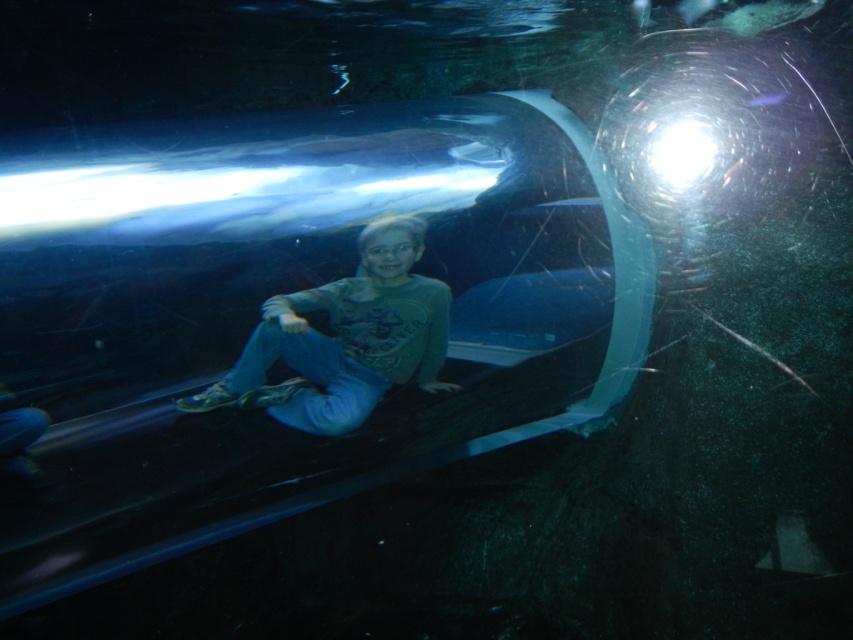
You are a diver in the aquarium tunnel. You see the matte gray shirt at center and the transparent glass bubble at upper center. Which object is closer to the light source in the upper right corner?

The transparent glass bubble at upper center is closer to the light source in the upper right corner because it is positioned above the matte gray shirt at center, which is located below it.

You are a photographer trying to capture a clear image of the point at coordinates (308, 305) in the underwater scene. Based on the provided information, what is the minimum distance your camera should be set to focus at to ensure the point is in sharp focus?

The point at coordinates (308, 305) is 4.85 feet from the camera, so the camera should be set to focus at a minimum distance of 4.85 feet to ensure the point is in sharp focus.

You are an underwater tour guide. You need to inform visitors about the distance between the matte gray shirt at center and the transparent glass bubble at upper center. What do you tell them?

The matte gray shirt at center and the transparent glass bubble at upper center are 25.73 inches apart from each other.